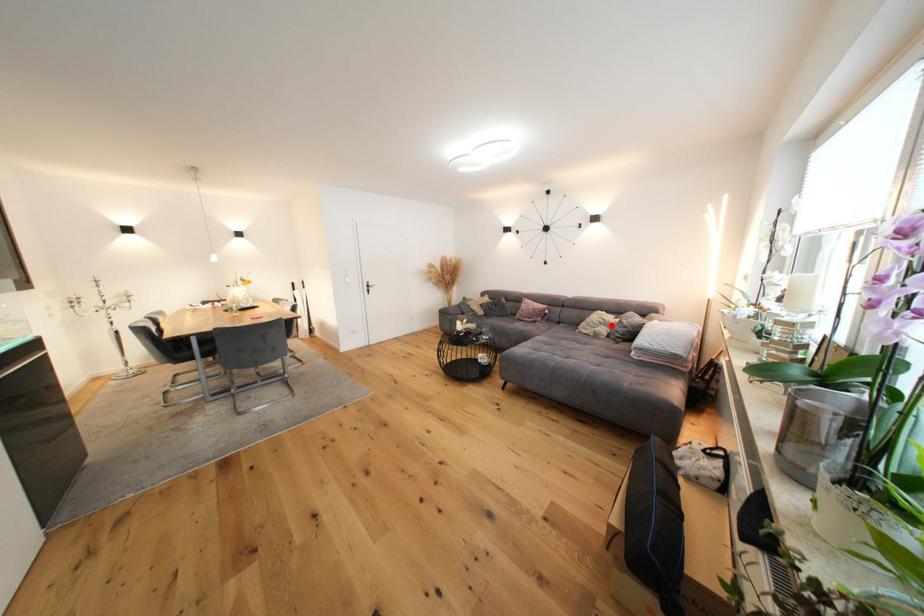
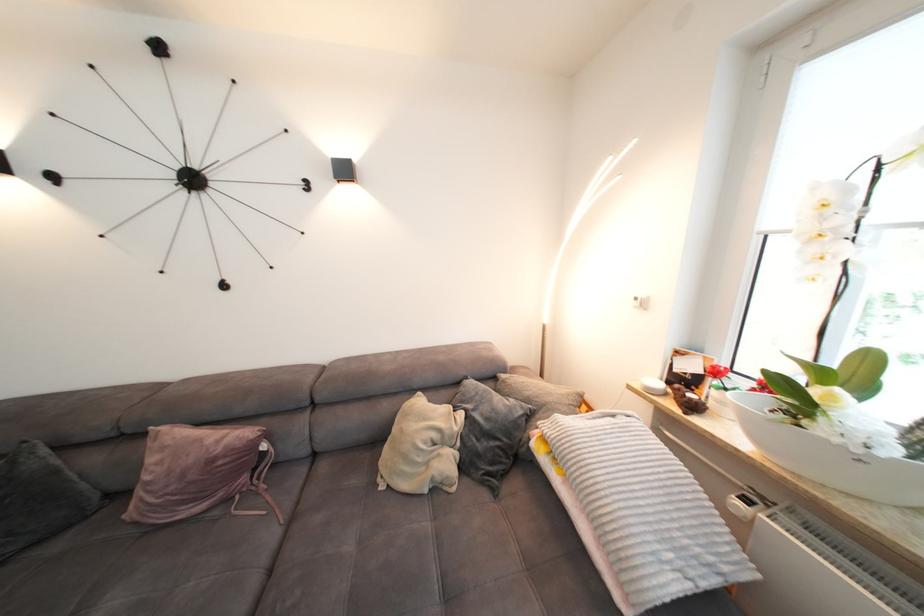
Question: I am providing you with two images of the same scene from different viewpoints. A red point is shown in image1. For the corresponding object point in image2, is it positioned nearer or farther from the camera?

Choices:
 (A) Nearer
 (B) Farther

Answer: (B)